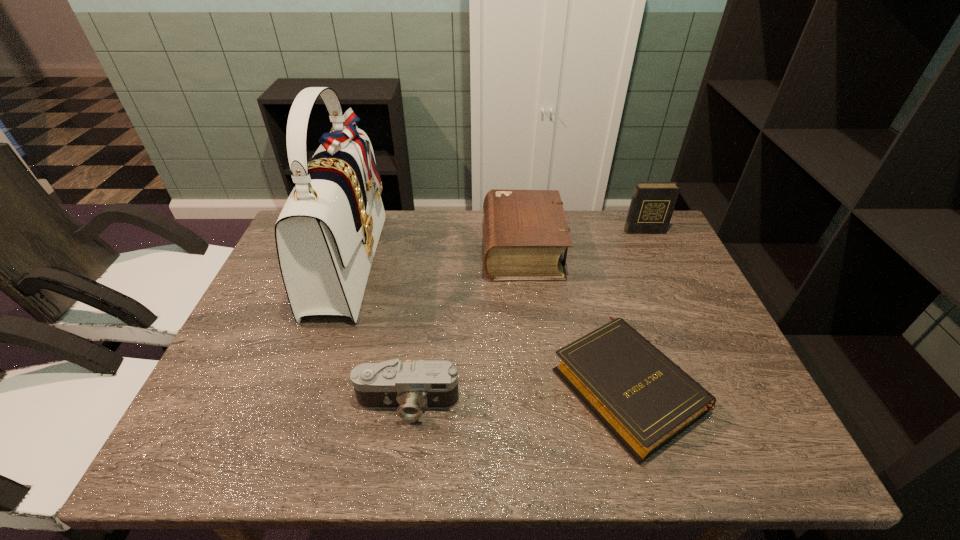
Choose which object is the second nearest neighbor to the fourth object from right to left. Please provide its 2D coordinates. Your answer should be formatted as a tuple, i.e. [(x, y)], where the tuple contains the x and y coordinates of a point satisfying the conditions above.

[(644, 400)]

The height and width of the screenshot is (540, 960). In order to click on object that stands as the fourth closest to the fourth shortest object in this screenshot , I will do `click(409, 387)`.

You are a GUI agent. You are given a task and a screenshot of the screen. Output one action in this format:
    pyautogui.click(x=<x>, y=<y>)
    Task: Click on the vacant point that satisfies the following two spatial constraints: 1. on the front cover of the second tallest object; 2. on the front-facing side of the tallest object
    This screenshot has height=540, width=960.
    Given the screenshot: What is the action you would take?
    pyautogui.click(x=659, y=261)

The height and width of the screenshot is (540, 960). Identify the location of free location that satisfies the following two spatial constraints: 1. on the spine side of the taller Bible; 2. on the lens of the second shortest object. (540, 403).

Where is `free location that satisfies the following two spatial constraints: 1. on the front cover of the diary; 2. on the front-facing side of the tallest object`? free location that satisfies the following two spatial constraints: 1. on the front cover of the diary; 2. on the front-facing side of the tallest object is located at coordinates (659, 261).

Where is `vacant area in the image that satisfies the following two spatial constraints: 1. on the front cover of the diary; 2. on the front-facing side of the satchel`? The height and width of the screenshot is (540, 960). vacant area in the image that satisfies the following two spatial constraints: 1. on the front cover of the diary; 2. on the front-facing side of the satchel is located at coordinates (659, 261).